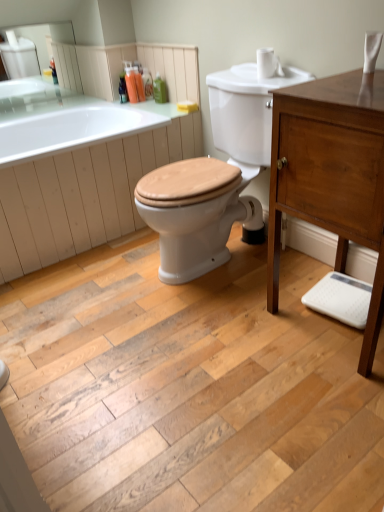
Locate an element on the screen. free location to the left of white glossy toilet at center is located at coordinates (96, 292).